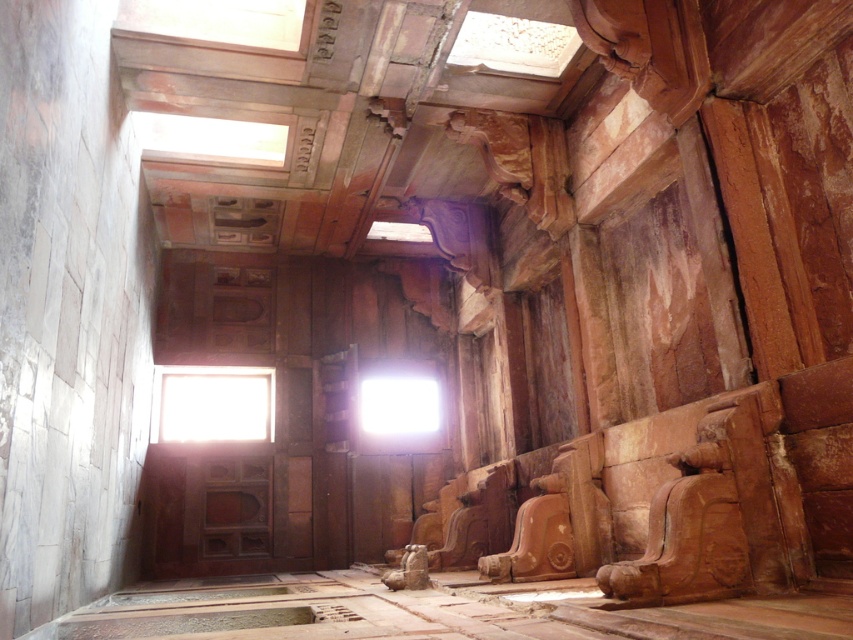
Does transparent glass window at center have a smaller size compared to bright white glass at center?

No, transparent glass window at center is not smaller than bright white glass at center.

How distant is transparent glass window at center from bright white glass at center?

The distance of transparent glass window at center from bright white glass at center is 7.33 feet.

Is point (248, 403) closer to camera compared to point (409, 392)?

No.

Find the location of a particular element. transparent glass window at center is located at coordinates (212, 403).